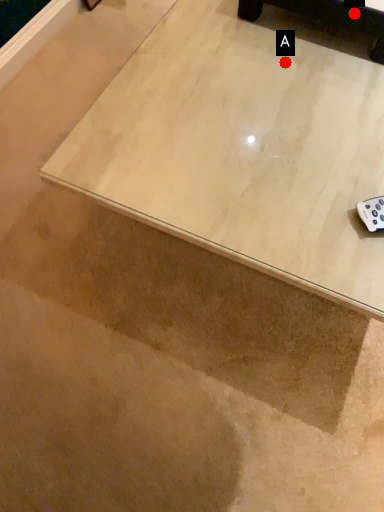
Question: Two points are circled on the image, labeled by A and B beside each circle. Which point is closer to the camera taking this photo?

Choices:
 (A) A is closer
 (B) B is closer

Answer: (A)